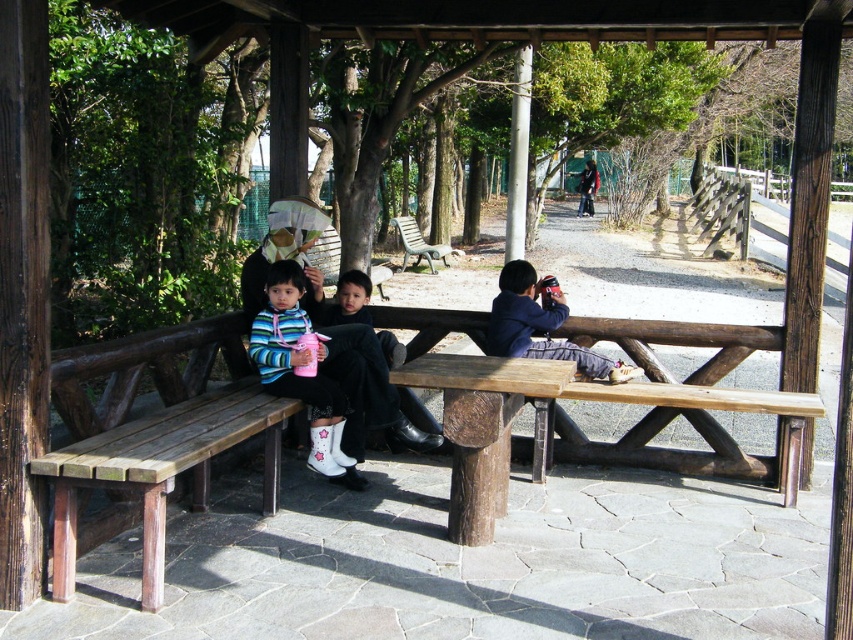
You are standing under the wooden pavilion and want to sit on the wooden bench at center. However, there is a striped fabric sweater at center in your way. Based on the scene description, can you reach the bench without moving the sweater?

The wooden bench at center is in front of the striped fabric sweater at center, meaning the bench is closer to you than the sweater. Therefore, you can sit on the wooden bench at center without needing to move the striped fabric sweater at center since it is behind the bench.

You are a photographer setting up a tripod in the pavilion. The wooden bench at center and the striped fabric sweater at center are both in your view. Since you want to focus on the smaller object, which one should you choose?

The striped fabric sweater at center is smaller than the wooden bench at center, so you should focus on the striped fabric sweater at center.